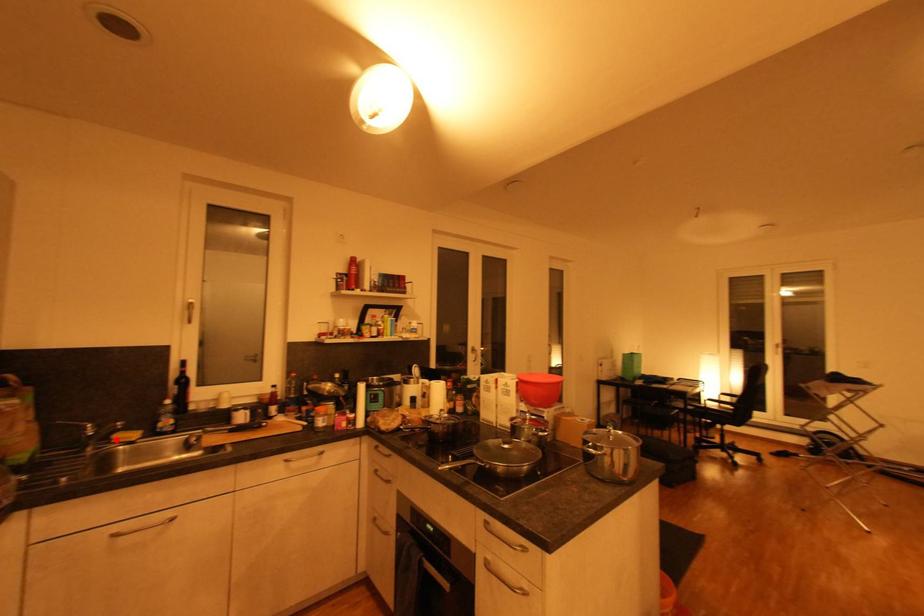
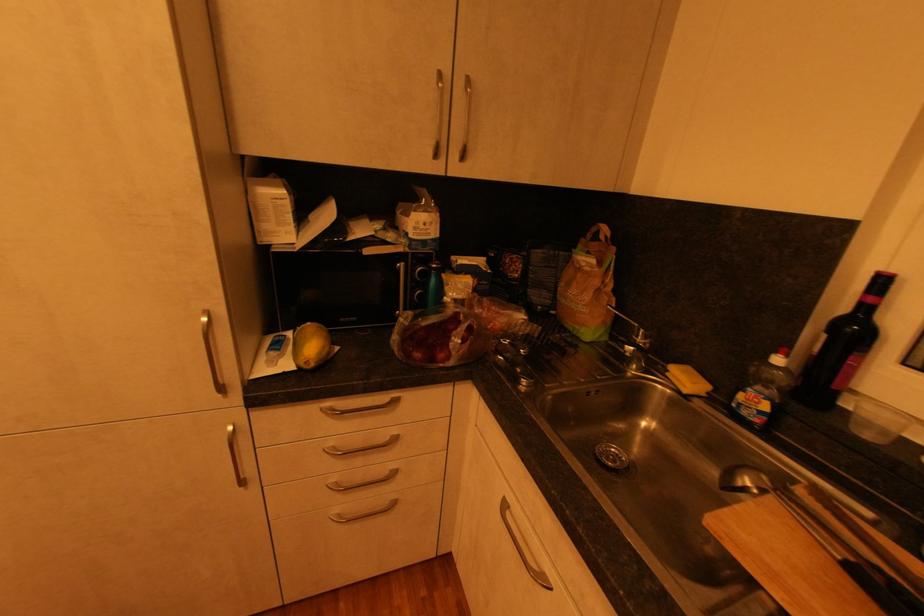
Question: I am providing you with two images of the same scene from different viewpoints. A red point is marked on the first image. Is the red point's position out of view in image 2?

Choices:
 (A) Yes
 (B) No

Answer: (B)